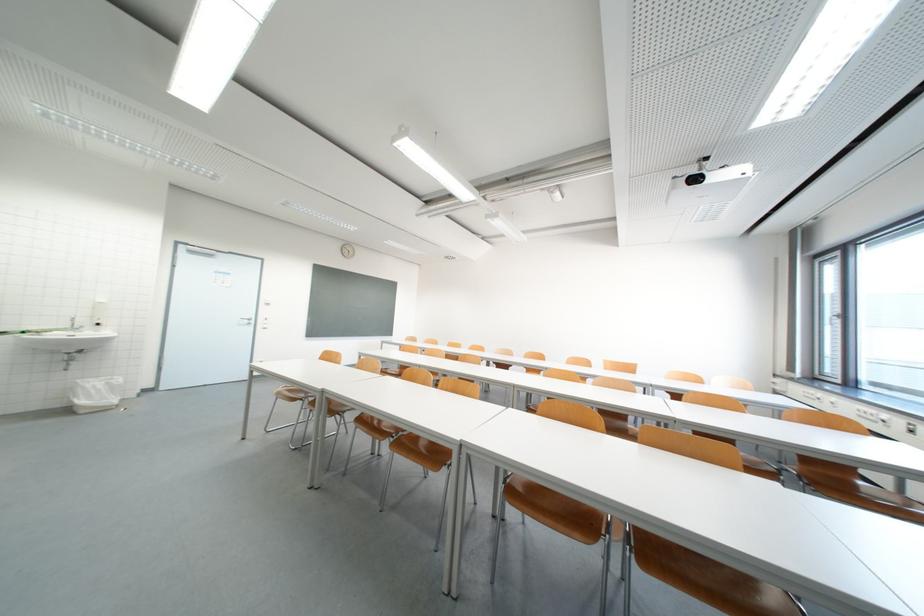
The image size is (924, 616). Describe the element at coordinates (71, 321) in the screenshot. I see `the faucet handle` at that location.